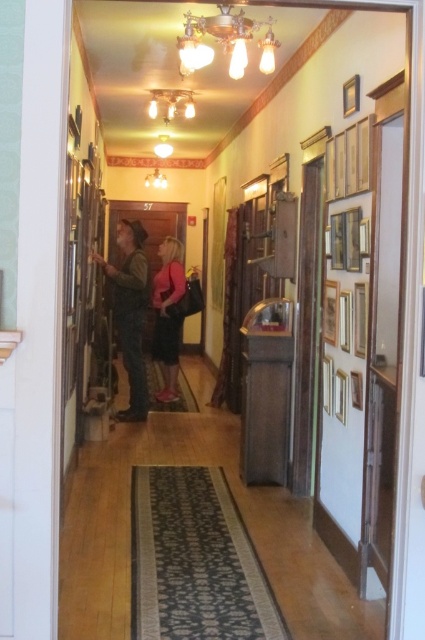
Can you confirm if camouflage pants at center is bigger than matte pink dress at center?

Indeed, camouflage pants at center has a larger size compared to matte pink dress at center.

What do you see at coordinates (130, 310) in the screenshot? The image size is (425, 640). I see `camouflage pants at center` at bounding box center [130, 310].

Locate an element on the screen. camouflage pants at center is located at coordinates (130, 310).